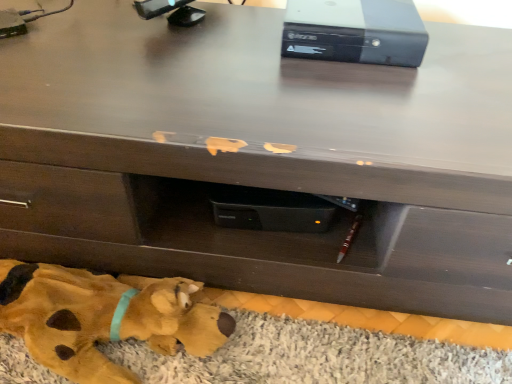
Question: From the image's perspective, is yellow plush toy at lower left under yellow fabric mat at lower left?

Choices:
 (A) yes
 (B) no

Answer: (B)

Question: Does yellow plush toy at lower left appear on the right side of yellow fabric mat at lower left?

Choices:
 (A) no
 (B) yes

Answer: (A)

Question: Does yellow plush toy at lower left have a lesser height compared to yellow fabric mat at lower left?

Choices:
 (A) no
 (B) yes

Answer: (A)

Question: From a real-world perspective, does yellow plush toy at lower left stand above yellow fabric mat at lower left?

Choices:
 (A) yes
 (B) no

Answer: (A)

Question: Can yellow fabric mat at lower left be found inside yellow plush toy at lower left?

Choices:
 (A) no
 (B) yes

Answer: (A)

Question: Does yellow plush toy at lower left have a smaller size compared to yellow fabric mat at lower left?

Choices:
 (A) yes
 (B) no

Answer: (B)

Question: Is black plastic computer at upper center at the left side of yellow plush toy at lower left?

Choices:
 (A) no
 (B) yes

Answer: (A)

Question: Considering the relative sizes of black plastic computer at upper center and yellow plush toy at lower left in the image provided, is black plastic computer at upper center taller than yellow plush toy at lower left?

Choices:
 (A) no
 (B) yes

Answer: (A)

Question: From the image's perspective, is black plastic computer at upper center located above yellow plush toy at lower left?

Choices:
 (A) yes
 (B) no

Answer: (A)

Question: Could you tell me if black plastic computer at upper center is turned towards yellow plush toy at lower left?

Choices:
 (A) yes
 (B) no

Answer: (B)

Question: Can you confirm if black plastic computer at upper center is shorter than yellow plush toy at lower left?

Choices:
 (A) no
 (B) yes

Answer: (B)

Question: Does black plastic computer at upper center have a greater width compared to yellow plush toy at lower left?

Choices:
 (A) yes
 (B) no

Answer: (A)

Question: Could you tell me if yellow fabric mat at lower left is turned towards black plastic computer at upper center?

Choices:
 (A) yes
 (B) no

Answer: (B)